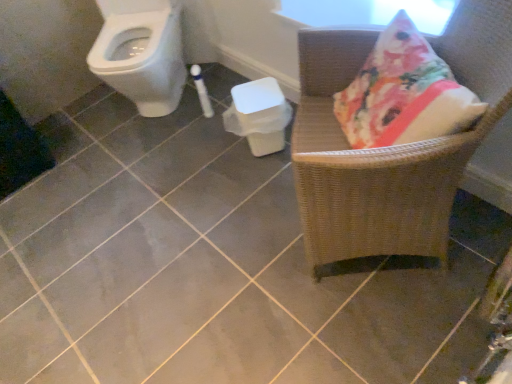
Question: From the image's perspective, is white plastic potty at center under woven wood chair at right?

Choices:
 (A) no
 (B) yes

Answer: (A)

Question: Is white plastic potty at center closer to camera compared to woven wood chair at right?

Choices:
 (A) yes
 (B) no

Answer: (B)

Question: Does white plastic potty at center have a smaller size compared to woven wood chair at right?

Choices:
 (A) no
 (B) yes

Answer: (B)

Question: Is the position of white plastic potty at center more distant than that of woven wood chair at right?

Choices:
 (A) no
 (B) yes

Answer: (B)

Question: Does white plastic potty at center have a lesser height compared to woven wood chair at right?

Choices:
 (A) yes
 (B) no

Answer: (A)

Question: Can you confirm if white plastic potty at center is wider than woven wood chair at right?

Choices:
 (A) yes
 (B) no

Answer: (B)

Question: Is the depth of white plastic potty at center less than that of white glossy toilet at upper left?

Choices:
 (A) no
 (B) yes

Answer: (A)

Question: From a real-world perspective, is white plastic potty at center on white glossy toilet at upper left?

Choices:
 (A) no
 (B) yes

Answer: (A)

Question: Would you consider white plastic potty at center to be distant from white glossy toilet at upper left?

Choices:
 (A) yes
 (B) no

Answer: (B)

Question: Is white plastic potty at center at the left side of white glossy toilet at upper left?

Choices:
 (A) yes
 (B) no

Answer: (B)

Question: Is white glossy toilet at upper left surrounded by white plastic potty at center?

Choices:
 (A) yes
 (B) no

Answer: (B)

Question: Does white plastic potty at center have a smaller size compared to white glossy toilet at upper left?

Choices:
 (A) yes
 (B) no

Answer: (A)

Question: From the image's perspective, is woven wood chair at right on white plastic potty at center?

Choices:
 (A) no
 (B) yes

Answer: (A)